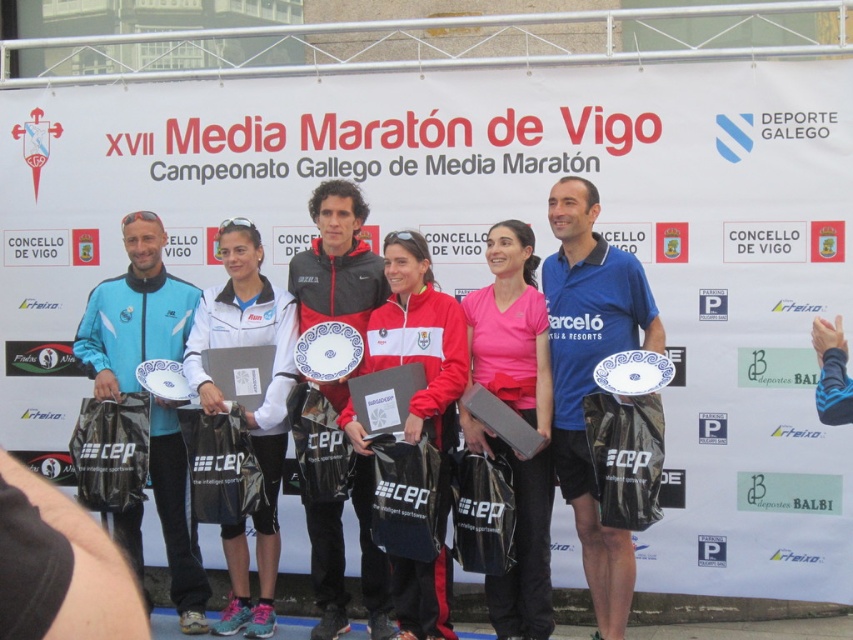
Question: Which of the following is the farthest from the observer?

Choices:
 (A) (341, 390)
 (B) (650, 314)

Answer: (A)

Question: Estimate the real-world distances between objects in this image. Which object is farther from the pink matte jersey at center?

Choices:
 (A) red and white jacket at center
 (B) light blue synthetic jacket at center

Answer: (B)

Question: Is pink matte jersey at center bigger than white matte jacket at center?

Choices:
 (A) no
 (B) yes

Answer: (A)

Question: Is blue fabric shirt at center to the left of red and white jacket at center from the viewer's perspective?

Choices:
 (A) no
 (B) yes

Answer: (A)

Question: Is blue fabric shirt at center further to the viewer compared to red and white jacket at center?

Choices:
 (A) no
 (B) yes

Answer: (B)

Question: Among these points, which one is nearest to the camera?

Choices:
 (A) (287, 349)
 (B) (587, 214)
 (C) (100, 384)

Answer: (B)